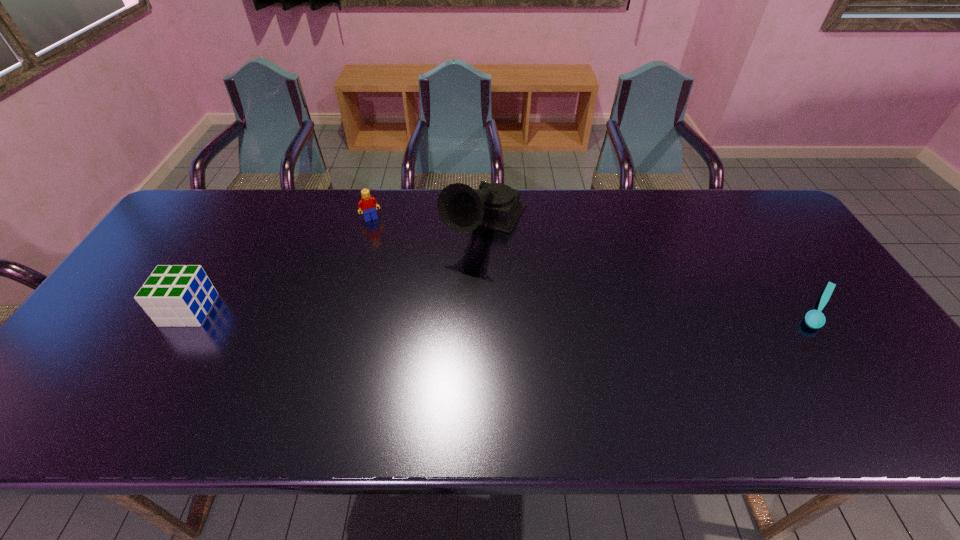
In order to click on free space on the desktop that is between the cube and the rightmost object and is positioned from the horn of the tallest object in this screenshot , I will do `click(432, 309)`.

What are the coordinates of `free space on the desktop that is between the leftmost object and the rightmost object and is positioned on the face of the second object from left to right` in the screenshot? It's located at (416, 309).